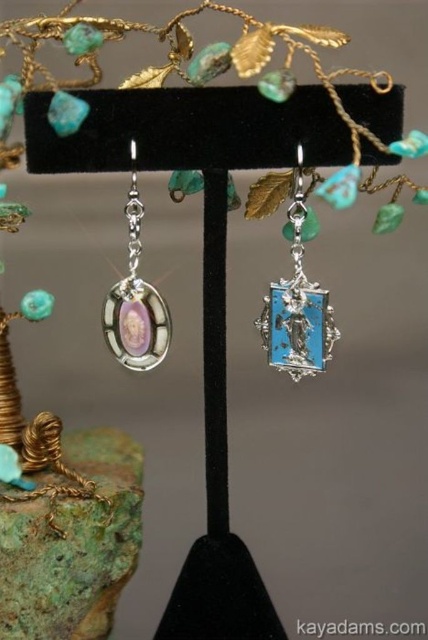
Does green patina stone at lower left appear on the right side of matte silver oval at left?

No, green patina stone at lower left is not to the right of matte silver oval at left.

Does point (47, 529) lie behind point (157, 321)?

Yes, it is.

Who is more forward, (11, 573) or (149, 310)?

Positioned in front is point (149, 310).

Where is `green patina stone at lower left`? Image resolution: width=428 pixels, height=640 pixels. green patina stone at lower left is located at coordinates (x=73, y=545).

Is the position of green patina stone at lower left more distant than that of turquoise enamel angel at center?

That is True.

Which is more to the left, green patina stone at lower left or turquoise enamel angel at center?

Positioned to the left is green patina stone at lower left.

You are a GUI agent. You are given a task and a screenshot of the screen. Output one action in this format:
    pyautogui.click(x=<x>, y=<y>)
    Task: Click on the green patina stone at lower left
    The height and width of the screenshot is (640, 428).
    Given the screenshot: What is the action you would take?
    pyautogui.click(x=73, y=545)

What are the coordinates of `green patina stone at lower left` in the screenshot? It's located at (73, 545).

Is point (311, 324) farther from viewer compared to point (106, 300)?

No.

Is turquoise enamel angel at center below matte silver oval at left?

Yes.

The image size is (428, 640). Describe the element at coordinates (297, 304) in the screenshot. I see `turquoise enamel angel at center` at that location.

Locate an element on the screen. This screenshot has height=640, width=428. turquoise enamel angel at center is located at coordinates (297, 304).